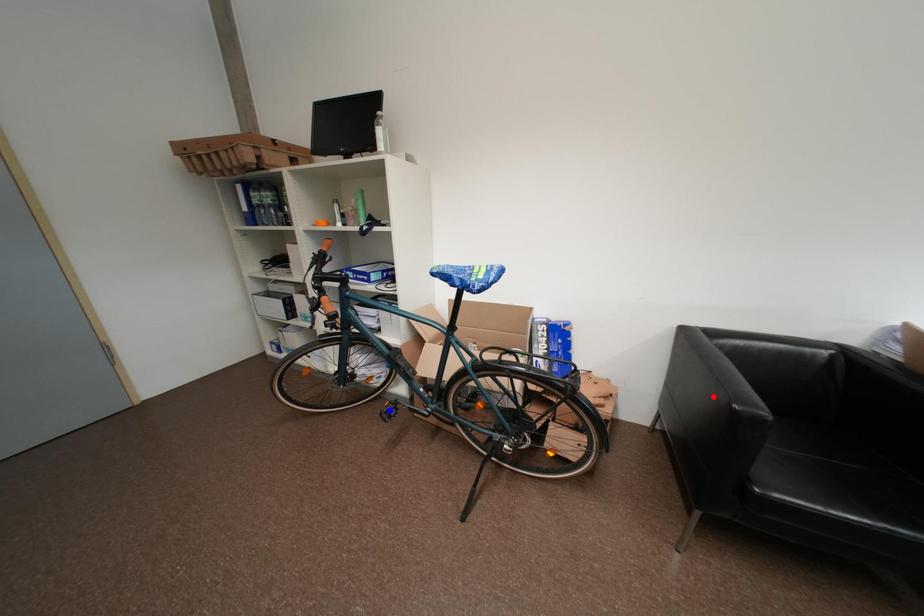
Question: In the image, two points are highlighted. Which point is nearer to the camera? Reply with the corresponding letter.

Choices:
 (A) blue point
 (B) red point

Answer: (B)